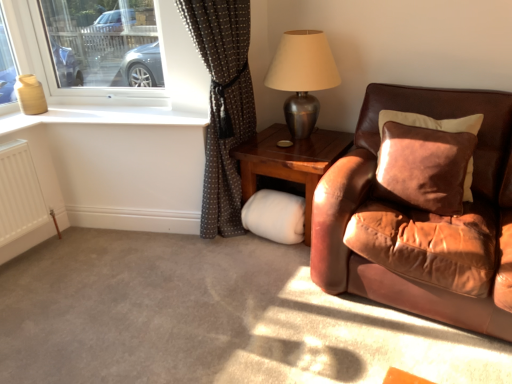
Question: Considering the relative sizes of brown leather couch at right and suede brown pillow at right in the image provided, is brown leather couch at right thinner than suede brown pillow at right?

Choices:
 (A) no
 (B) yes

Answer: (A)

Question: Is brown leather couch at right shorter than suede brown pillow at right?

Choices:
 (A) yes
 (B) no

Answer: (B)

Question: Considering the relative sizes of brown leather couch at right and suede brown pillow at right in the image provided, is brown leather couch at right bigger than suede brown pillow at right?

Choices:
 (A) no
 (B) yes

Answer: (B)

Question: Can you confirm if brown leather couch at right is positioned to the right of suede brown pillow at right?

Choices:
 (A) no
 (B) yes

Answer: (B)

Question: Is brown leather couch at right outside suede brown pillow at right?

Choices:
 (A) no
 (B) yes

Answer: (B)

Question: Is suede brown pillow at right located within brown leather couch at right?

Choices:
 (A) no
 (B) yes

Answer: (B)

Question: Is suede brown pillow at right not close to brown dotted fabric at left?

Choices:
 (A) no
 (B) yes

Answer: (A)

Question: From a real-world perspective, is suede brown pillow at right located higher than brown dotted fabric at left?

Choices:
 (A) yes
 (B) no

Answer: (B)

Question: Considering the relative sizes of suede brown pillow at right and brown dotted fabric at left in the image provided, is suede brown pillow at right bigger than brown dotted fabric at left?

Choices:
 (A) yes
 (B) no

Answer: (B)

Question: Can you confirm if suede brown pillow at right is positioned to the left of brown dotted fabric at left?

Choices:
 (A) yes
 (B) no

Answer: (B)

Question: From a real-world perspective, is suede brown pillow at right under brown dotted fabric at left?

Choices:
 (A) yes
 (B) no

Answer: (A)

Question: From the image's perspective, is suede brown pillow at right beneath brown dotted fabric at left?

Choices:
 (A) no
 (B) yes

Answer: (B)

Question: Is white glossy window sill at upper left not near clear glass window at upper left?

Choices:
 (A) yes
 (B) no

Answer: (B)